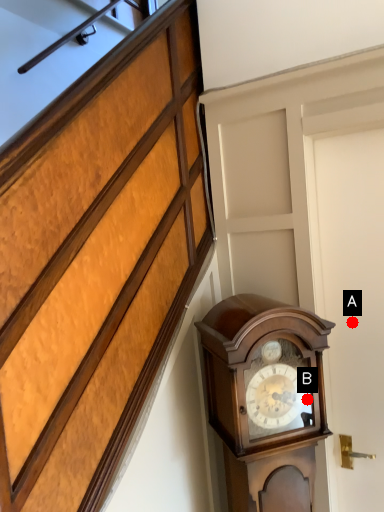
Question: Two points are circled on the image, labeled by A and B beside each circle. Which point is closer to the camera taking this photo?

Choices:
 (A) A is closer
 (B) B is closer

Answer: (B)